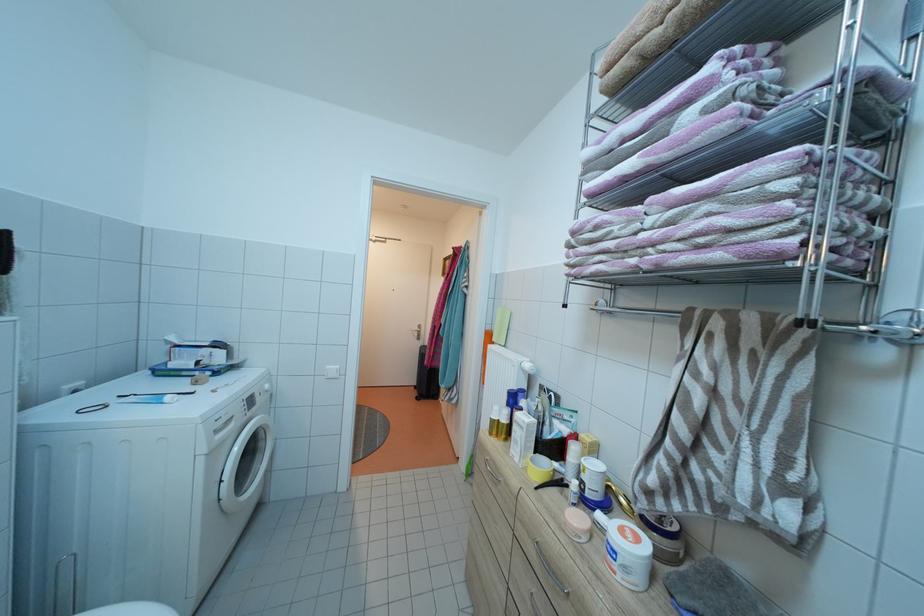
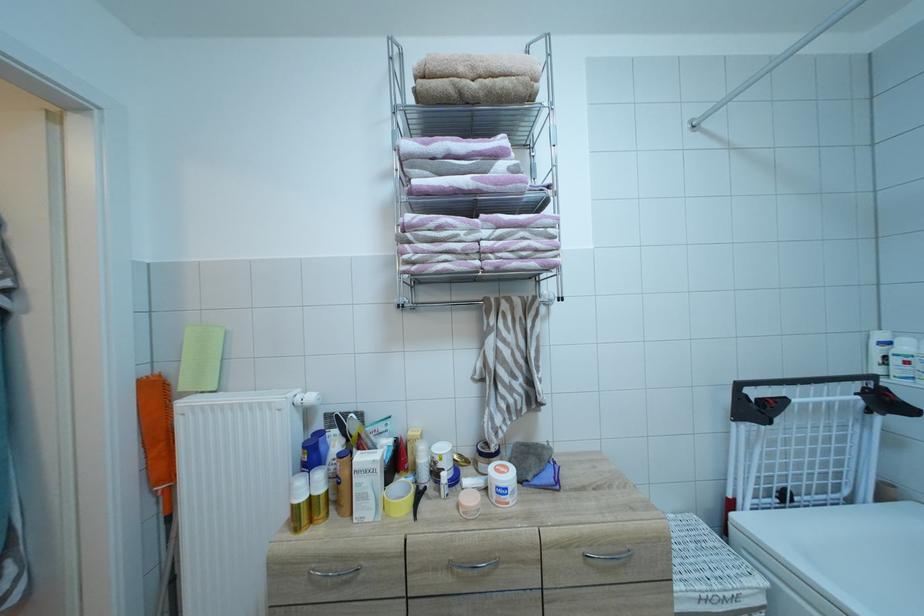
Question: The camera is either moving clockwise (left) or counter-clockwise (right) around the object. The first image is from the beginning of the video and the second image is from the end. Is the camera moving left or right when shooting the video?

Choices:
 (A) Left
 (B) Right

Answer: (A)